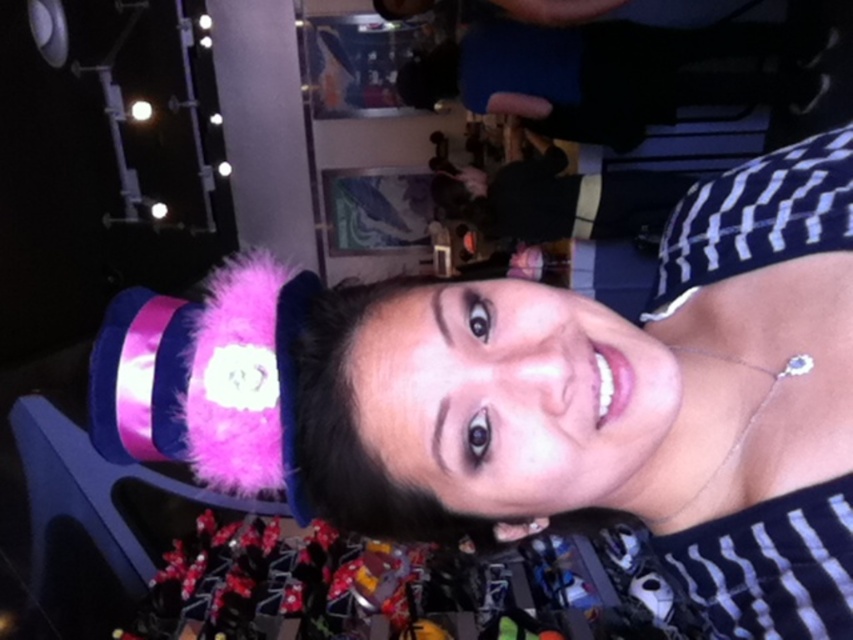
You are an interior designer assessing the lighting in this room. You notice the matte pink fur hat at upper left and the pink fuzzy hat at upper center. Which hat has a larger width when viewed from the front?

The pink fuzzy hat at upper center has a larger width when viewed from the front because the matte pink fur hat at upper left is thinner than it.

You are at a party and want to take a photo of both the matte pink fur hat at upper left and the pink fuzzy hat at upper center. Since you can only focus on one hat at a time, which hat should you focus on first if you want to capture them both in the frame?

You should focus on the pink fuzzy hat at upper center first because the matte pink fur hat at upper left is positioned on the left side of it, so adjusting the focus between them would keep both in the frame.